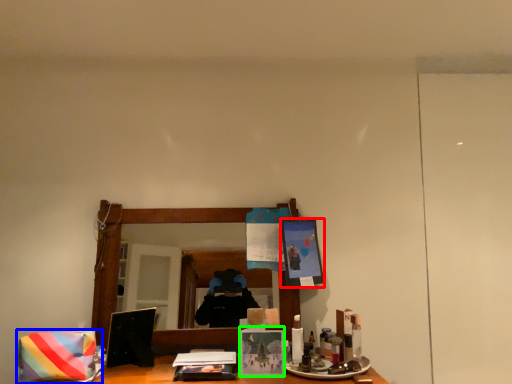
Question: Which is nearer to the picture frame (highlighted by a red box)? material (highlighted by a blue box) or picture frame (highlighted by a green box).

Choices:
 (A) material
 (B) picture frame

Answer: (B)